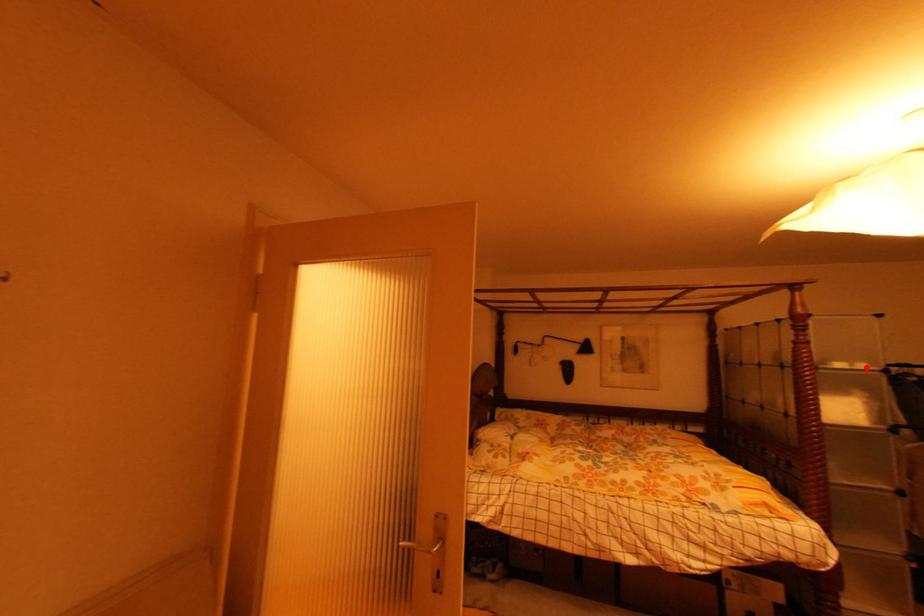
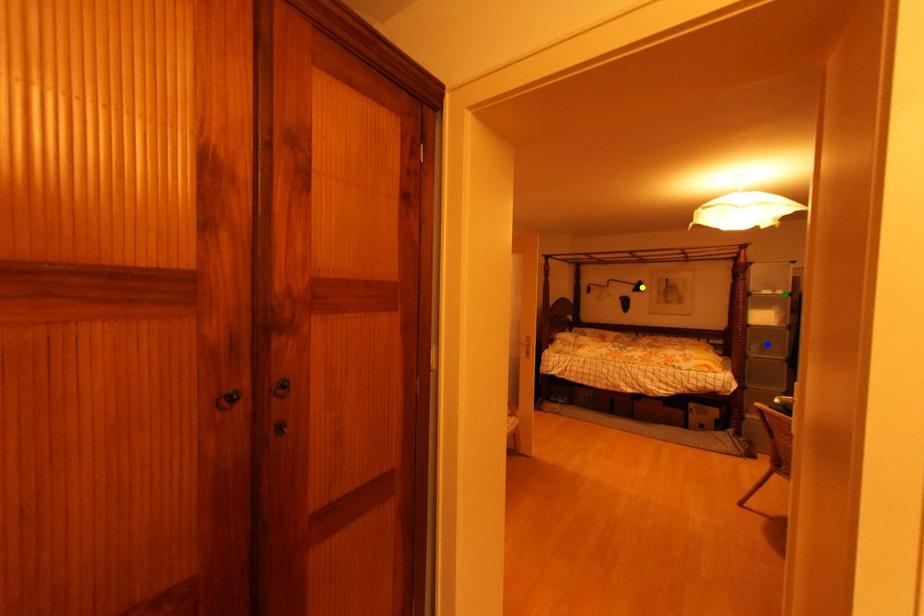
Question: I am providing you with two images of the same scene from different viewpoints. A red point is marked on the first image. You are given multiple points on the second image. Which spot in image 2 lines up with the point in image 1?

Choices:
 (A) green point
 (B) yellow point
 (C) blue point

Answer: (A)